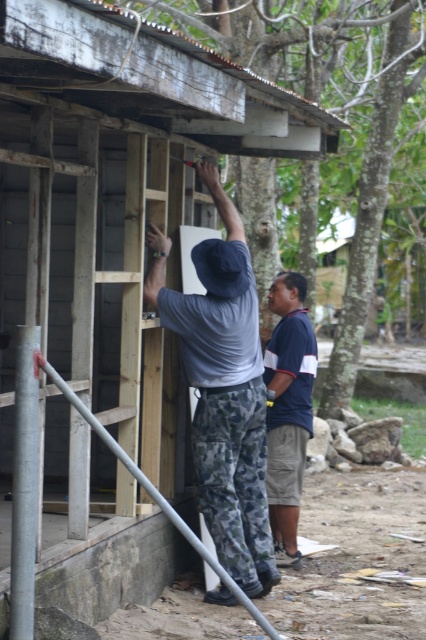
Question: Can you confirm if brown wood tree at upper center is positioned below blue striped shirt at center?

Choices:
 (A) no
 (B) yes

Answer: (A)

Question: Does brown wood tree at upper center have a smaller size compared to blue striped shirt at center?

Choices:
 (A) yes
 (B) no

Answer: (A)

Question: Based on their relative distances, which object is nearer to the brown wood tree at upper center?

Choices:
 (A) camouflage pants at center
 (B) blue striped shirt at center

Answer: (B)

Question: Can you confirm if camouflage pants at center is thinner than blue striped shirt at center?

Choices:
 (A) no
 (B) yes

Answer: (A)

Question: Which object appears farthest from the camera in this image?

Choices:
 (A) blue striped shirt at center
 (B) camouflage pants at center

Answer: (A)

Question: Estimate the real-world distances between objects in this image. Which object is farther from the camouflage pants at center?

Choices:
 (A) blue striped shirt at center
 (B) brown wood tree at upper center

Answer: (B)